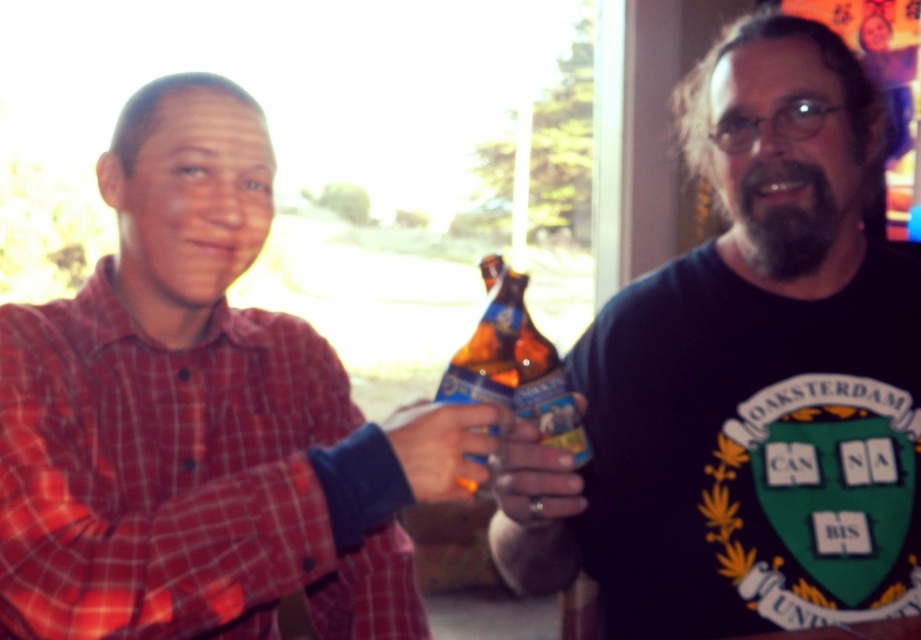
Question: Can you confirm if translucent plastic bottle at center is smaller than matte plastic beer bottle at center?

Choices:
 (A) yes
 (B) no

Answer: (A)

Question: Which of the following is the closest to the observer?

Choices:
 (A) (83, 301)
 (B) (561, 396)
 (C) (510, 465)
 (D) (459, 483)

Answer: (D)

Question: Which of the following is the closest to the observer?

Choices:
 (A) matte plastic ring at center
 (B) red plaid shirt at left

Answer: (B)

Question: Does matte plastic beer bottle at center have a larger size compared to translucent glass bottle at center?

Choices:
 (A) yes
 (B) no

Answer: (A)

Question: Which object appears closest to the camera in this image?

Choices:
 (A) translucent plastic bottle at center
 (B) red plaid shirt at left
 (C) black matte t-shirt at center
 (D) matte plastic beer bottle at center

Answer: (B)

Question: Can you confirm if translucent plastic bottle at center is positioned below matte plastic beer bottle at center?

Choices:
 (A) no
 (B) yes

Answer: (A)